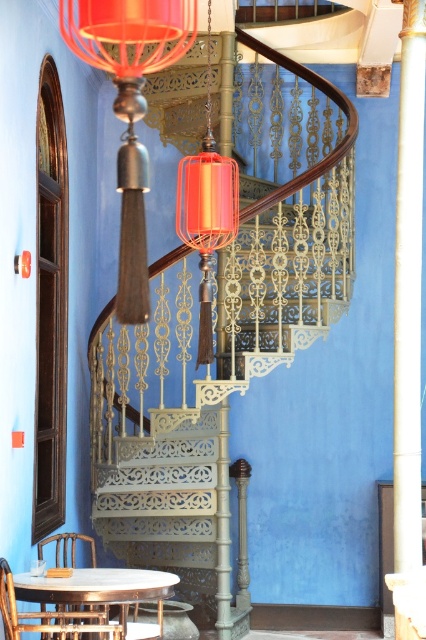
Does point (420, 540) come closer to viewer compared to point (32, 593)?

No.

Can you confirm if white glossy column at right is wider than white marble table at lower center?

No.

The height and width of the screenshot is (640, 426). Identify the location of white glossy column at right. (408, 291).

The width and height of the screenshot is (426, 640). Identify the location of white glossy column at right. (408, 291).

This screenshot has height=640, width=426. I want to click on matte silver lamp at center, so click(x=129, y=108).

This screenshot has height=640, width=426. What are the coordinates of `matte silver lamp at center` in the screenshot? It's located at pos(129,108).

Looking at this image, can you confirm if metallic staircase at center is positioned to the right of wooden chair at lower left?

Indeed, metallic staircase at center is positioned on the right side of wooden chair at lower left.

Which is more to the left, metallic staircase at center or wooden chair at lower left?

wooden chair at lower left is more to the left.

Between point (307, 330) and point (66, 534), which one is positioned in front?

Point (66, 534) is in front.

You are a GUI agent. You are given a task and a screenshot of the screen. Output one action in this format:
    pyautogui.click(x=<x>, y=<y>)
    Task: Click on the metallic staircase at center
    
    Given the screenshot: What is the action you would take?
    pyautogui.click(x=222, y=339)